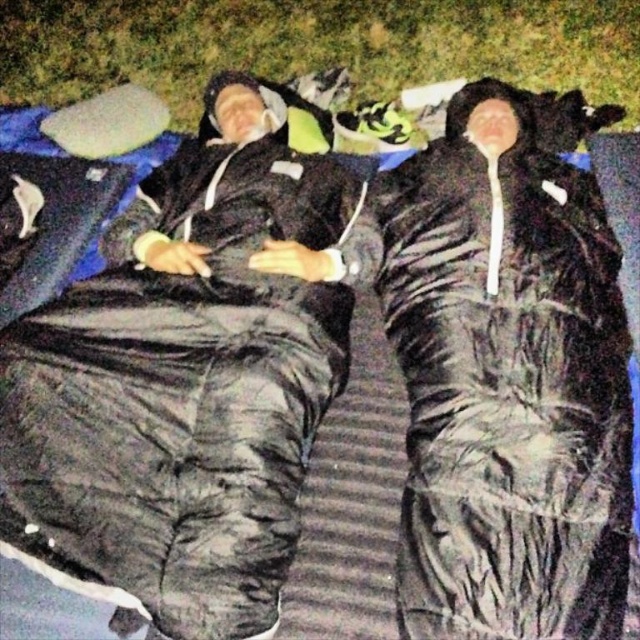
In the scene shown: You are planning to set up a tent in this scene. The tent requires a flat area free of obstructions like sleeping bags or grass. Based on the scene, where should you place the tent to avoid the black matte sleeping bag at center and the green grass at upper center?

The black matte sleeping bag at center is located below the green grass at upper center. To avoid both, place the tent in an area not below the green grass at upper center and not where the sleeping bag is positioned.

You are a delivery person who needs to place a 1.2 meter long package between the two black matte sleeping bag at center. Will the package fit between them?

The two black matte sleeping bag at center are 1.13 meters apart. Since the package is 1.2 meters long, it will not fit between them as the distance is slightly shorter than the package length.

You are a photographer trying to capture a closeup of the black matte sleeping bag at center without the green grass at upper center appearing in the background. Based on their positions, is this possible?

The black matte sleeping bag at center is in front of the green grass at upper center, so it is possible to take a closeup of the black matte sleeping bag at center without the green grass at upper center in the background by focusing on the sleeping bag and ensuring the grass is out of frame.